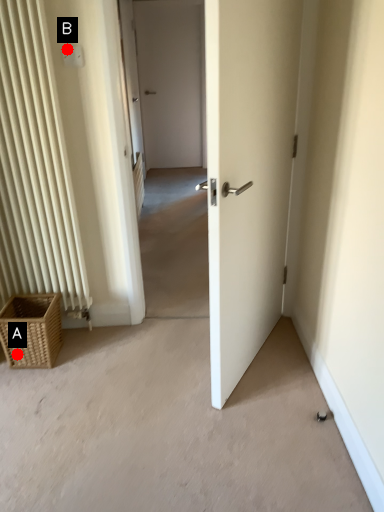
Question: Two points are circled on the image, labeled by A and B beside each circle. Which point is closer to the camera?

Choices:
 (A) A is closer
 (B) B is closer

Answer: (B)